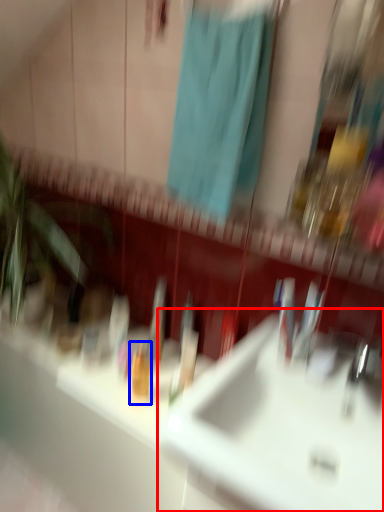
Question: Which point is further to the camera, sink (highlighted by a red box) or toiletry (highlighted by a blue box)?

Choices:
 (A) sink
 (B) toiletry

Answer: (B)